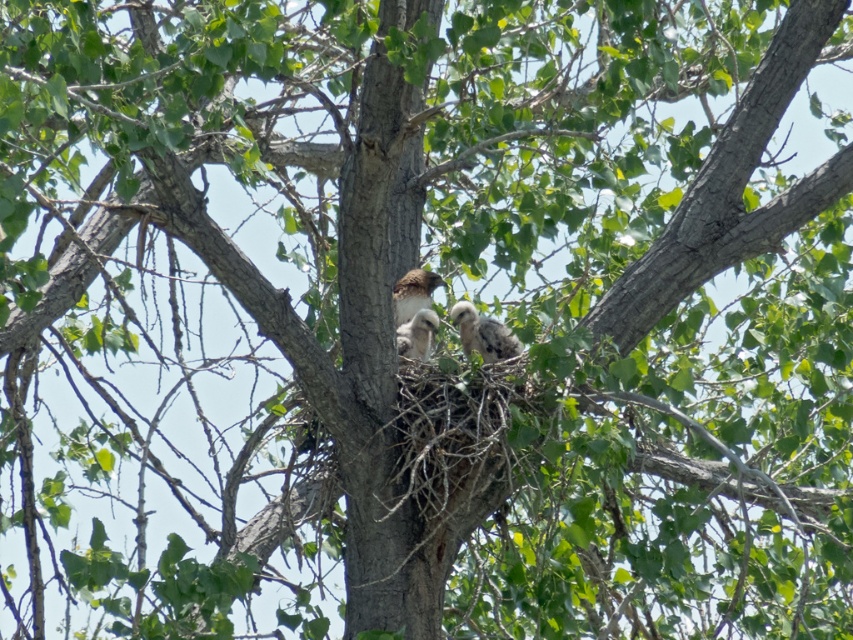
Question: Among these points, which one is nearest to the camera?

Choices:
 (A) (419, 339)
 (B) (474, 330)

Answer: (B)

Question: Is brown speckled feathers at center wider than speckled feathered bird at center?

Choices:
 (A) yes
 (B) no

Answer: (A)

Question: Is brown speckled feathers at center positioned before speckled feathered bird at center?

Choices:
 (A) no
 (B) yes

Answer: (A)

Question: Which point is farther from the camera taking this photo?

Choices:
 (A) (434, 321)
 (B) (393, 304)

Answer: (B)

Question: Which of these objects is positioned closest to the speckled feathered bird at center?

Choices:
 (A) speckled feathered chick at center
 (B) brown speckled feathers at center

Answer: (B)

Question: Is speckled feathered chick at center positioned behind brown speckled feathers at center?

Choices:
 (A) yes
 (B) no

Answer: (B)